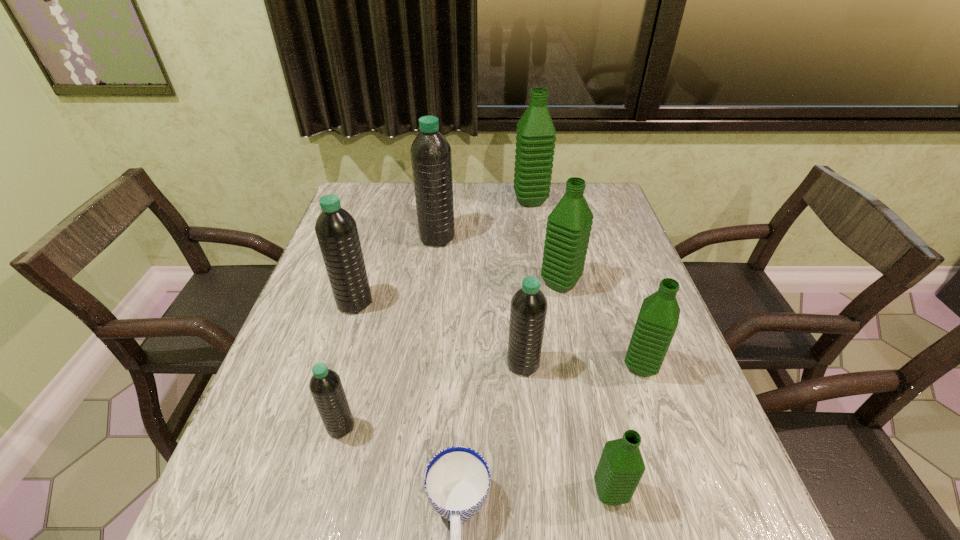
Where is `the second nearest water bottle`? the second nearest water bottle is located at coordinates (325, 385).

Where is `the nearest black water bottle`? This screenshot has height=540, width=960. the nearest black water bottle is located at coordinates (325, 385).

Identify the location of the nearest water bottle. This screenshot has width=960, height=540. (621, 466).

This screenshot has width=960, height=540. Identify the location of the smallest green water bottle. (621, 466).

Image resolution: width=960 pixels, height=540 pixels. I want to click on vacant area situated on the right of the second farthest object, so click(509, 238).

Where is `vacant area situated on the left of the farthest green water bottle`? The image size is (960, 540). vacant area situated on the left of the farthest green water bottle is located at coordinates (439, 200).

This screenshot has height=540, width=960. Identify the location of free space located 0.170m on the back of the second farthest green water bottle. [x=550, y=233].

This screenshot has width=960, height=540. In order to click on vacant space situated 0.310m on the back of the third nearest black water bottle in this screenshot , I will do `click(379, 224)`.

Locate an element on the screen. free region located on the back of the rightmost black water bottle is located at coordinates (519, 320).

The image size is (960, 540). I want to click on free space located on the back of the rightmost water bottle, so click(612, 283).